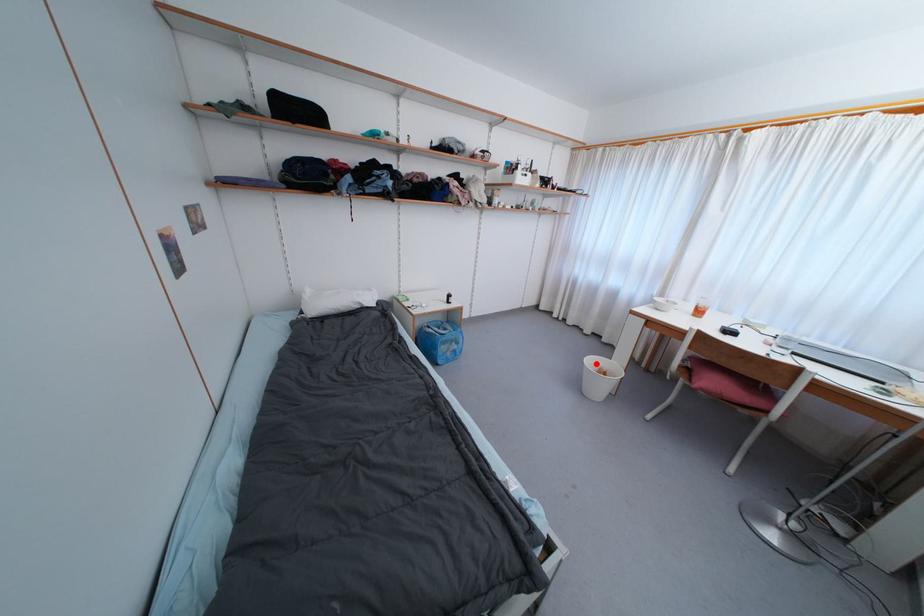
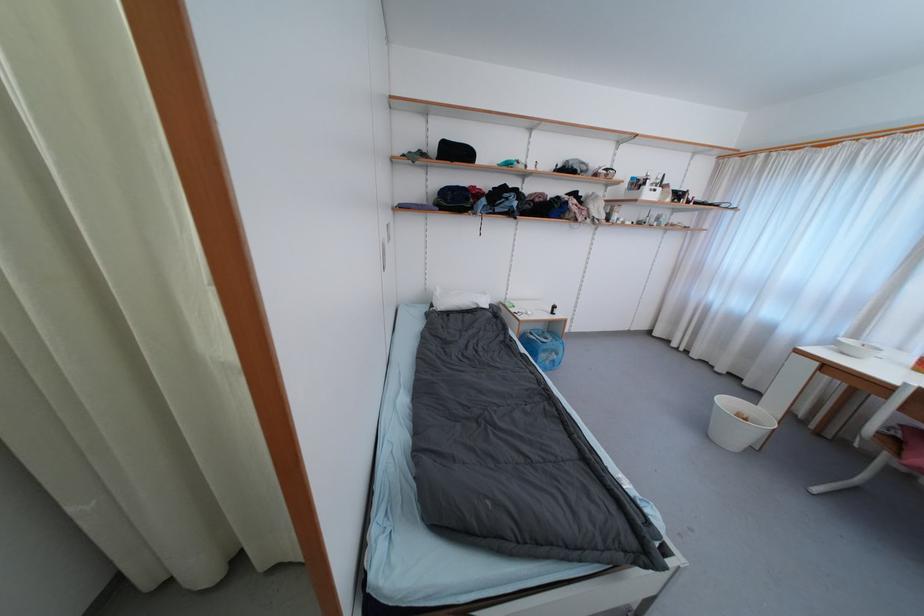
In the second image, find the point that corresponds to the highlighted location in the first image.

(732, 405)